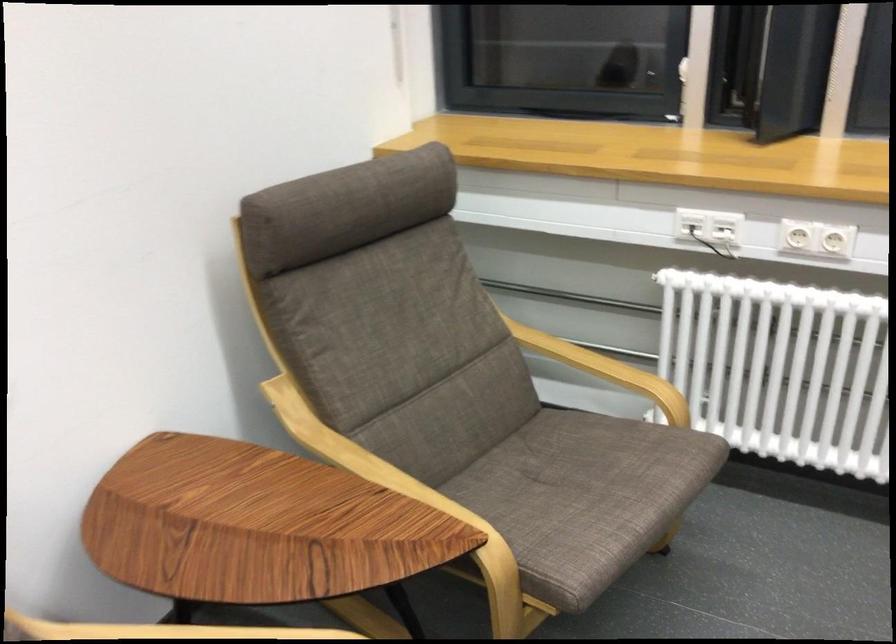
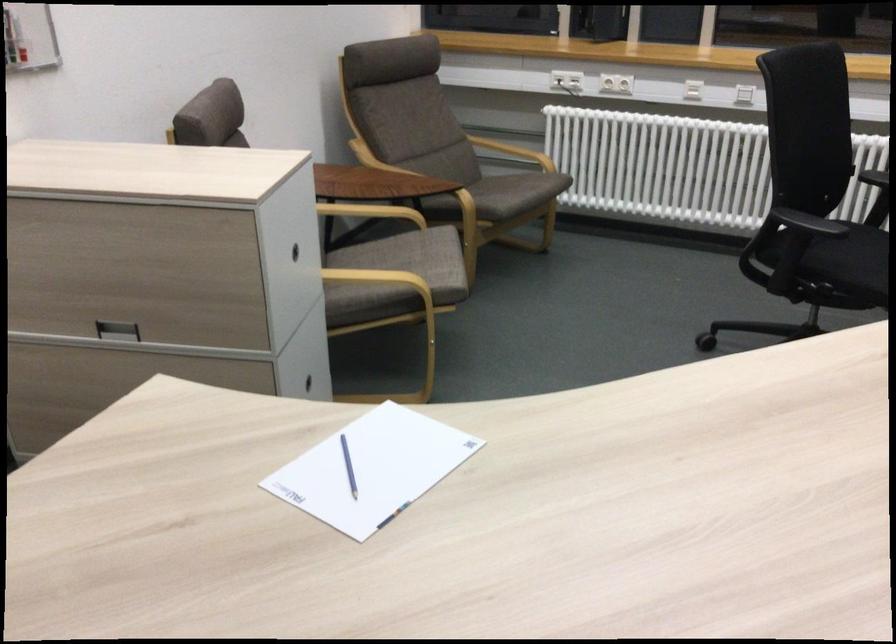
The point at (687, 243) is marked in the first image. Where is the corresponding point in the second image?

(566, 80)